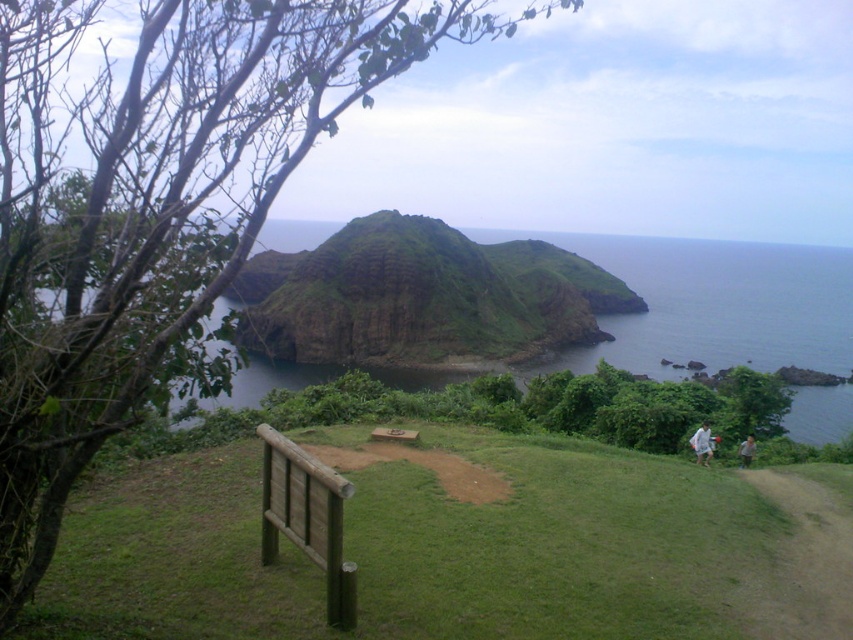
Question: Which point is closer to the camera?

Choices:
 (A) (602, 337)
 (B) (706, 445)
 (C) (786, 307)

Answer: (B)

Question: Among these objects, which one is farthest from the camera?

Choices:
 (A) light brown fabric shirt at lower right
 (B) brown wood bench at lower left
 (C) green rock at center
 (D) white fabric shirt at lower right

Answer: (C)

Question: From the image, what is the correct spatial relationship of white fabric shirt at lower right in relation to brown wooden bench at center?

Choices:
 (A) above
 (B) below

Answer: (B)

Question: Can you confirm if green rock at center is positioned to the right of green grassy hillside at lower center?

Choices:
 (A) no
 (B) yes

Answer: (A)

Question: Can you confirm if green grassy at center is positioned to the right of brown wooden bench at center?

Choices:
 (A) yes
 (B) no

Answer: (B)

Question: Which of the following is the farthest from the observer?

Choices:
 (A) (265, 461)
 (B) (706, 442)
 (C) (540, 269)
 (D) (740, 451)

Answer: (C)